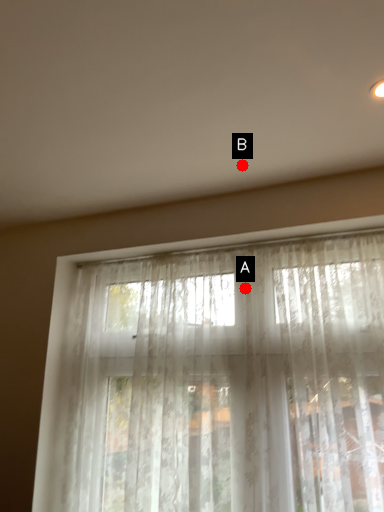
Question: Two points are circled on the image, labeled by A and B beside each circle. Which point appears farthest from the camera in this image?

Choices:
 (A) A is further
 (B) B is further

Answer: (A)